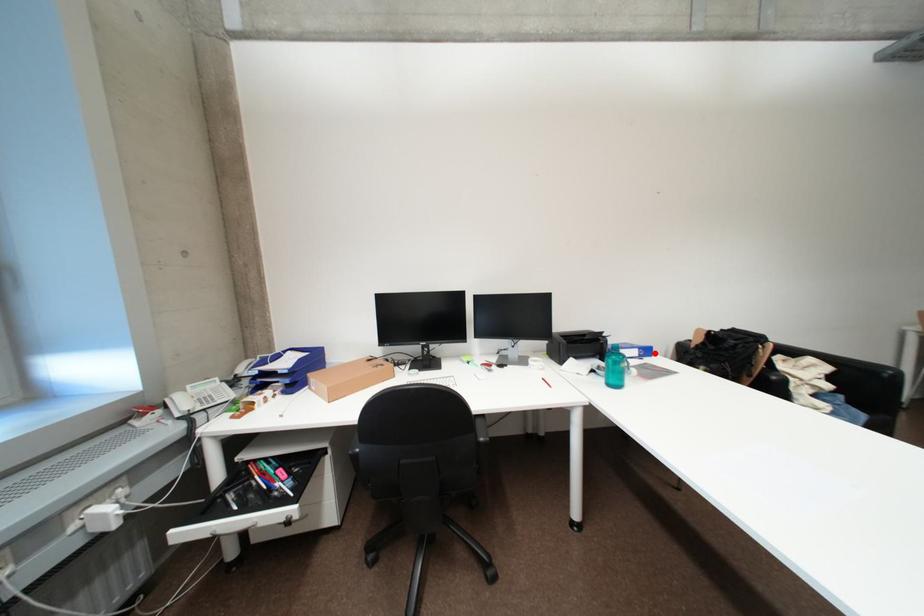
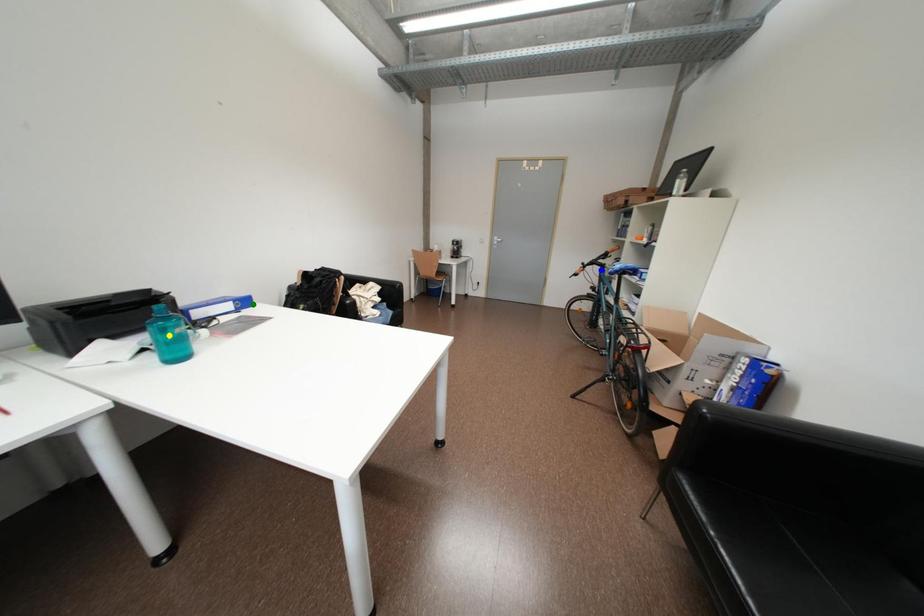
Question: I am providing you with two images of the same scene from different viewpoints. A red point is marked on the first image. You are given multiple points on the second image. Which point in image 2 represents the same 3d spot as the red point in image 1?

Choices:
 (A) yellow point
 (B) green point
 (C) blue point

Answer: (B)